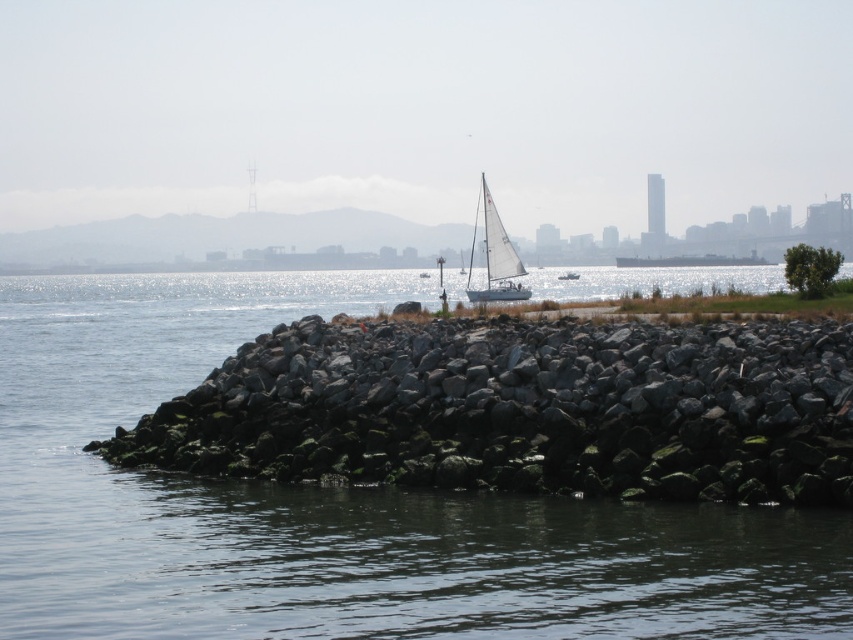
Question: Which of the following is the farthest from the observer?

Choices:
 (A) (572, 273)
 (B) (177, 340)

Answer: (A)

Question: Among these points, which one is farthest from the camera?

Choices:
 (A) [x=563, y=273]
 (B) [x=498, y=250]

Answer: (A)

Question: Estimate the real-world distances between objects in this image. Which object is farther from the white matte sailboat at center?

Choices:
 (A) white sailboat at center
 (B) gray rock at center

Answer: (B)

Question: Can you confirm if smooth gray water at center is smaller than white matte sailboat at center?

Choices:
 (A) yes
 (B) no

Answer: (B)

Question: Can you confirm if smooth gray water at center is positioned to the left of white sailboat at center?

Choices:
 (A) no
 (B) yes

Answer: (B)

Question: Considering the relative positions of gray rock at center and white matte sailboat at center in the image provided, where is gray rock at center located with respect to white matte sailboat at center?

Choices:
 (A) left
 (B) right

Answer: (A)